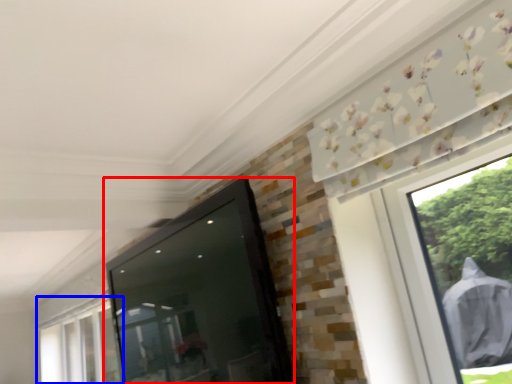
Question: Which of the following is the closest to the observer, screen door (highlighted by a red box) or window (highlighted by a blue box)?

Choices:
 (A) screen door
 (B) window

Answer: (A)